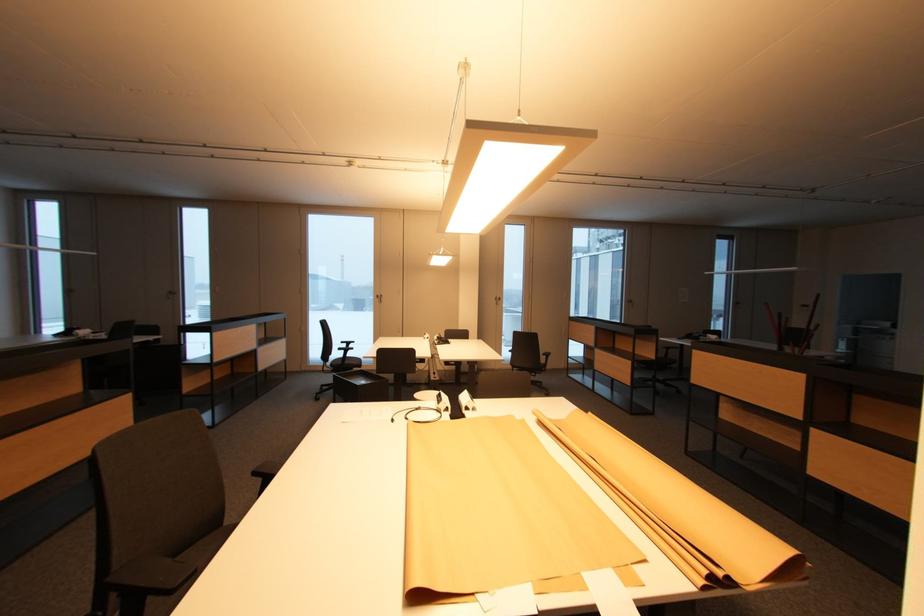
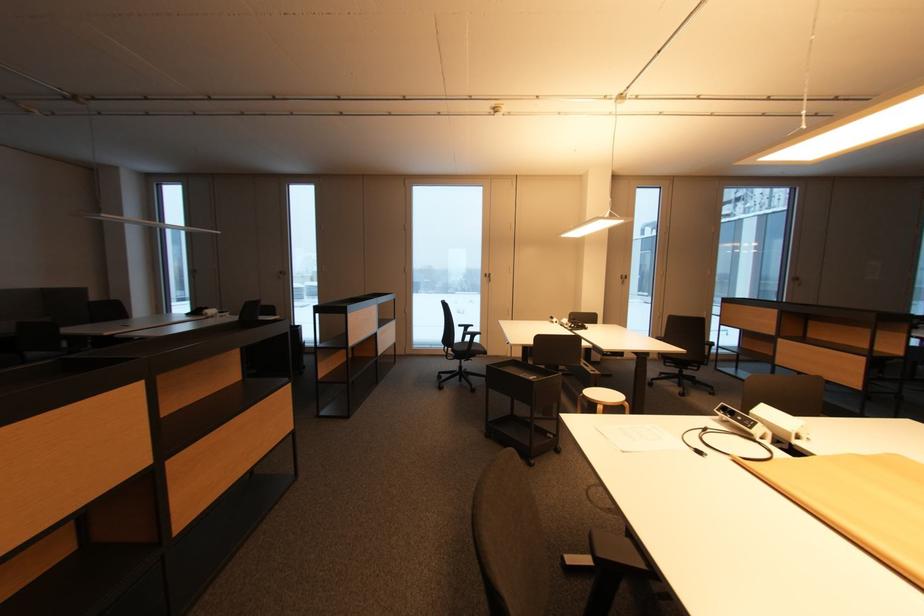
What movement of the cameraman would produce the second image?

The cameraman walked toward left, forward.